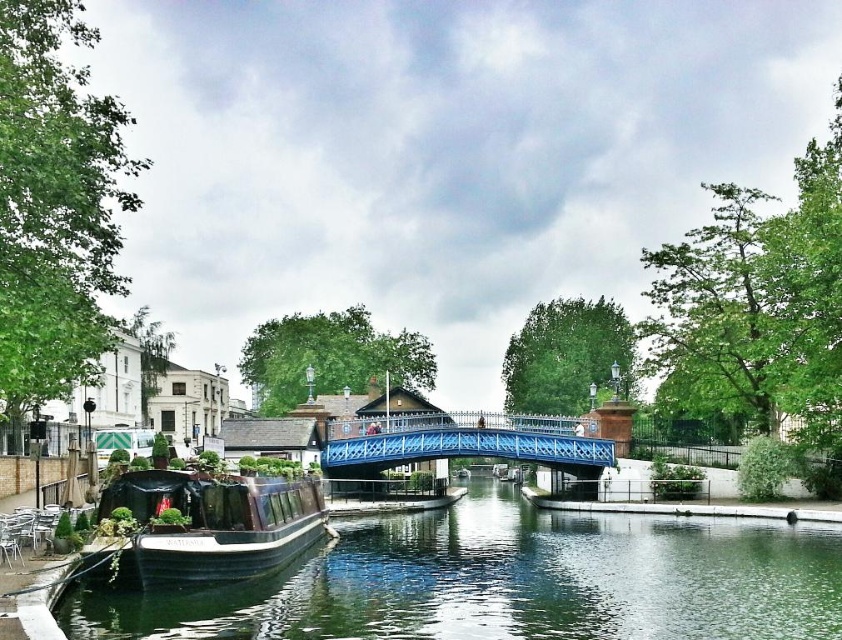
Is smooth black boat at lower left to the right of blue metallic bridge at center from the viewer's perspective?

Incorrect, smooth black boat at lower left is not on the right side of blue metallic bridge at center.

Between point (722, 592) and point (462, 417), which one is positioned in front?

Point (722, 592) is more forward.

Does point (749, 572) lie behind point (478, 435)?

No, (749, 572) is in front of (478, 435).

I want to click on smooth black boat at lower left, so click(509, 580).

Does wooden polished boat at lower left appear under blue metallic bridge at center?

Actually, wooden polished boat at lower left is above blue metallic bridge at center.

Is wooden polished boat at lower left taller than blue metallic bridge at center?

No, wooden polished boat at lower left is not taller than blue metallic bridge at center.

What do you see at coordinates (200, 528) in the screenshot? I see `wooden polished boat at lower left` at bounding box center [200, 528].

Image resolution: width=842 pixels, height=640 pixels. Find the location of `wooden polished boat at lower left`. wooden polished boat at lower left is located at coordinates (200, 528).

Can you confirm if smooth black boat at lower left is smaller than wooden polished boat at lower left?

No.

Is the position of smooth black boat at lower left more distant than that of wooden polished boat at lower left?

No.

Where is `smooth black boat at lower left`? smooth black boat at lower left is located at coordinates (509, 580).

Locate an element on the screen. This screenshot has width=842, height=640. smooth black boat at lower left is located at coordinates (509, 580).